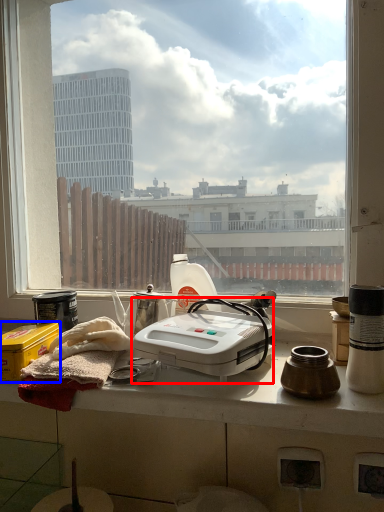
Question: Among these objects, which one is nearest to the camera, kitchen appliance (highlighted by a red box) or box (highlighted by a blue box)?

Choices:
 (A) kitchen appliance
 (B) box

Answer: (A)